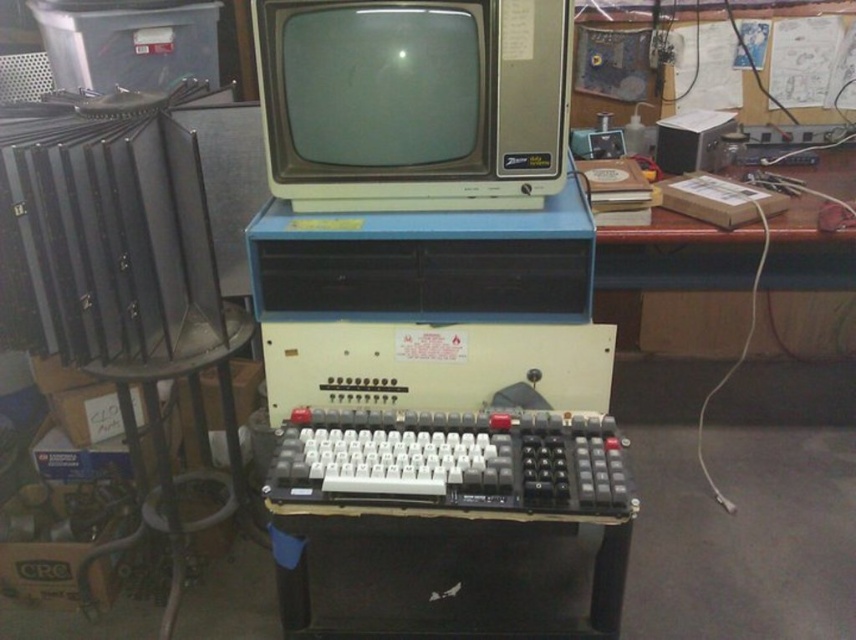
Question: Can you confirm if matte gray crt monitor at center is smaller than white plastic keyboard at center?

Choices:
 (A) no
 (B) yes

Answer: (A)

Question: Is matte gray crt monitor at center wider than white plastic keyboard at center?

Choices:
 (A) yes
 (B) no

Answer: (B)

Question: Does matte gray crt monitor at center appear under white plastic keyboard at center?

Choices:
 (A) no
 (B) yes

Answer: (A)

Question: Among these objects, which one is nearest to the camera?

Choices:
 (A) matte gray crt monitor at center
 (B) white plastic keyboard at center

Answer: (B)

Question: Which of the following is the closest to the observer?

Choices:
 (A) white plastic keyboard at center
 (B) matte gray crt monitor at center

Answer: (A)

Question: Which object is closer to the camera taking this photo?

Choices:
 (A) white plastic keyboard at center
 (B) matte gray crt monitor at center

Answer: (A)